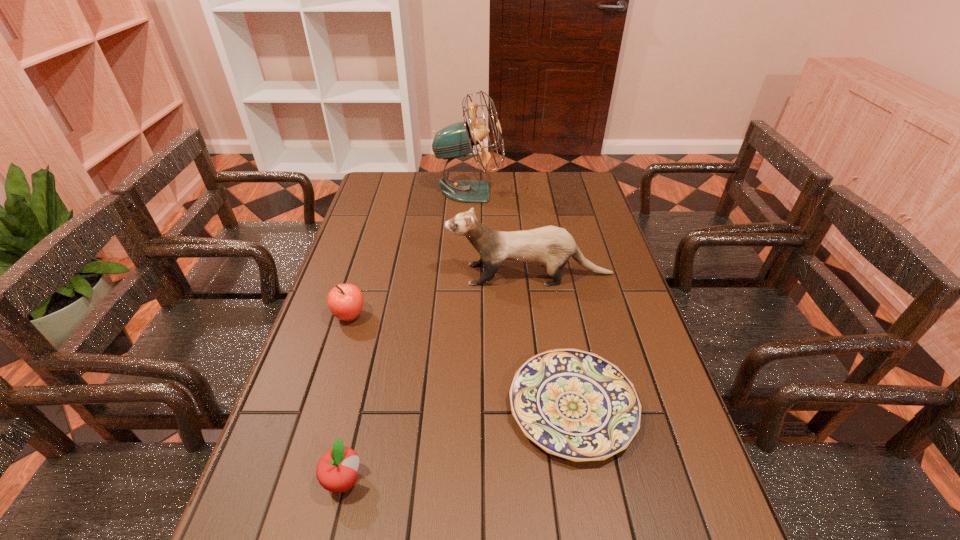
Find the location of `vacant space at the left edge`. vacant space at the left edge is located at coordinates (396, 211).

Where is `free region at the right edge`? free region at the right edge is located at coordinates (643, 442).

This screenshot has width=960, height=540. In the image, there is a desktop. What are the coordinates of `vacant space at the far left corner` in the screenshot? It's located at (383, 194).

At what (x,y) coordinates should I click in order to perform the action: click on empty space that is in between the right apple and the leftmost object. Please return your answer as a coordinate pair (x, y). This screenshot has width=960, height=540. Looking at the image, I should click on (347, 399).

Identify the location of blank region between the leftmost object and the plate. This screenshot has height=540, width=960. (461, 361).

Find the location of a particular element. The height and width of the screenshot is (540, 960). vacant area between the plate and the third farthest object is located at coordinates (461, 361).

This screenshot has width=960, height=540. I want to click on vacant space that is in between the farther apple and the fourth nearest object, so 440,295.

The height and width of the screenshot is (540, 960). What are the coordinates of `free space between the ferret and the third nearest object` in the screenshot? It's located at (440, 295).

Find the location of `unoccupied area between the second farthest object and the shortest object`. unoccupied area between the second farthest object and the shortest object is located at coordinates (551, 340).

This screenshot has height=540, width=960. Identify the location of unoccupied area between the nearer apple and the tallest object. (406, 336).